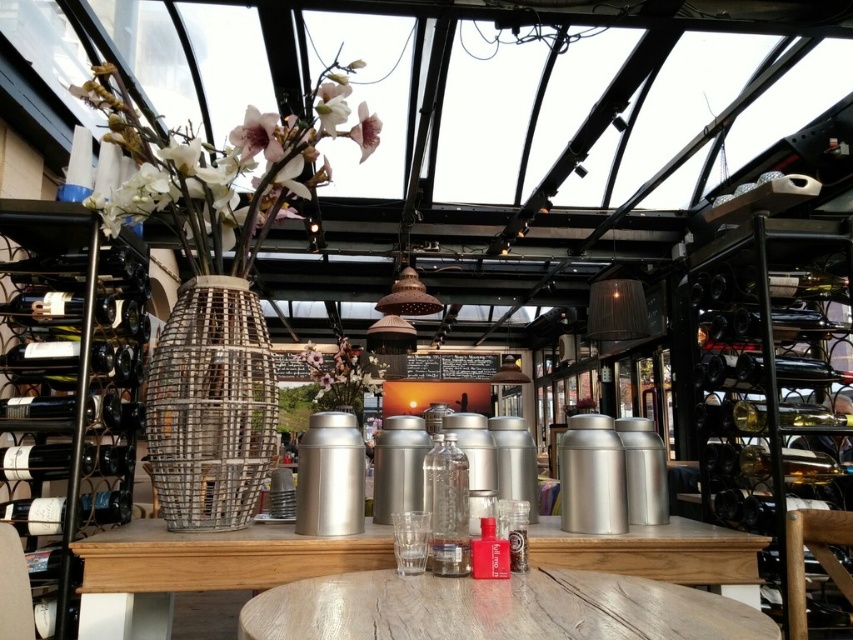
Question: Does wooden table at center have a greater width compared to light brown wooden table at center?

Choices:
 (A) no
 (B) yes

Answer: (A)

Question: Which of the following is the farthest from the observer?

Choices:
 (A) clear glass bottle at center
 (B) light brown wooden table at center

Answer: (A)

Question: Which object is closer to the camera taking this photo?

Choices:
 (A) pink matte flower at upper center
 (B) metallic woven basket at center

Answer: (B)

Question: Observing the image, what is the correct spatial positioning of dark green glass wine bottle at left in reference to metallic wire basket at center?

Choices:
 (A) left
 (B) right

Answer: (A)

Question: Which object is farther from the camera taking this photo?

Choices:
 (A) dark green glass wine bottle at left
 (B) pink matte flower at upper center
 (C) wooden table at center

Answer: (B)

Question: Does metallic woven basket at center appear on the left side of clear glass bottle at center?

Choices:
 (A) no
 (B) yes

Answer: (B)